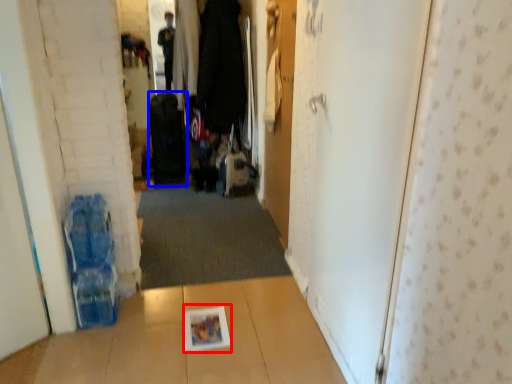
Question: Which point is further to the camera, magazine (highlighted by a red box) or luggage (highlighted by a blue box)?

Choices:
 (A) magazine
 (B) luggage

Answer: (B)